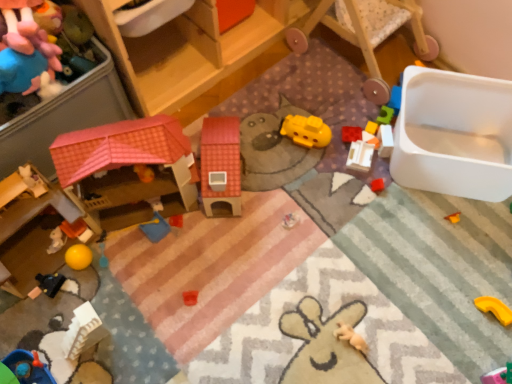
The width and height of the screenshot is (512, 384). What are the coordinates of `free space to the right of matte plastic dollhouse at center-left, the fourth toy viewed from the left` in the screenshot? It's located at (282, 195).